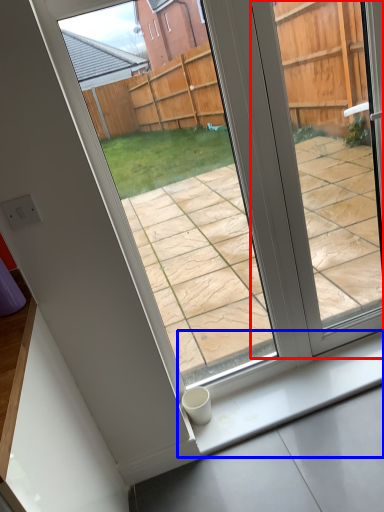
Question: Which of the following is the closest to the observer, window (highlighted by a red box) or window sill (highlighted by a blue box)?

Choices:
 (A) window
 (B) window sill

Answer: (A)